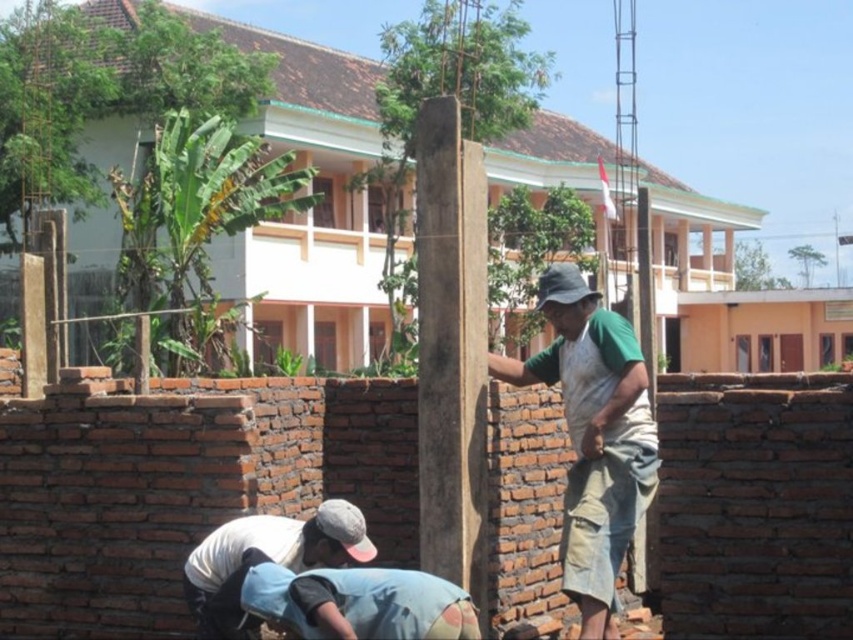
Question: In this image, where is green fabric apron at center located relative to blue denim jeans at lower center?

Choices:
 (A) below
 (B) above

Answer: (B)

Question: Does green fabric apron at center have a smaller size compared to blue denim jeans at lower center?

Choices:
 (A) yes
 (B) no

Answer: (B)

Question: Which point appears farthest from the camera in this image?

Choices:
 (A) (402, 637)
 (B) (619, 499)

Answer: (B)

Question: Does green fabric apron at center appear over denim cap at lower center?

Choices:
 (A) no
 (B) yes

Answer: (B)

Question: Which of the following is the farthest from the observer?

Choices:
 (A) (328, 579)
 (B) (254, 531)

Answer: (B)

Question: Among these points, which one is nearest to the camera?

Choices:
 (A) (270, 586)
 (B) (202, 605)
 (C) (648, 436)

Answer: (A)